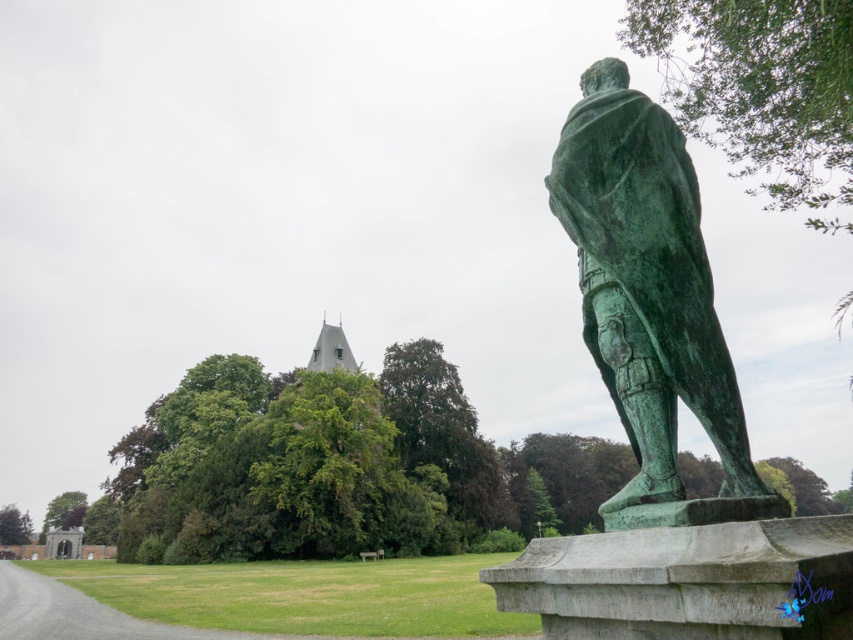
Does green patina statue at right appear over gray stone spire at upper center?

Indeed, green patina statue at right is positioned over gray stone spire at upper center.

Is green patina statue at right to the left of gray stone spire at upper center from the viewer's perspective?

In fact, green patina statue at right is to the right of gray stone spire at upper center.

Is point (726, 433) farther from camera compared to point (343, 349)?

No, it is not.

Find the location of `green patina statue at right`. green patina statue at right is located at coordinates (650, 300).